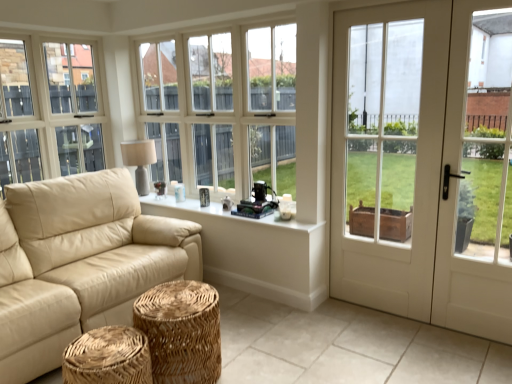
Identify the location of vacant space positioned to the left of white glossy door at right. (346, 334).